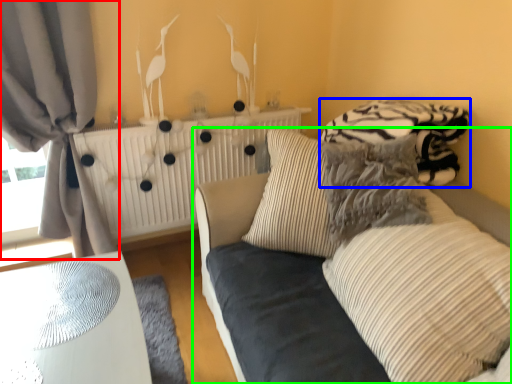
Question: Which object is positioned farthest from curtain (highlighted by a red box)? Select from bedding (highlighted by a blue box) and studio couch (highlighted by a green box).

Choices:
 (A) bedding
 (B) studio couch

Answer: (A)